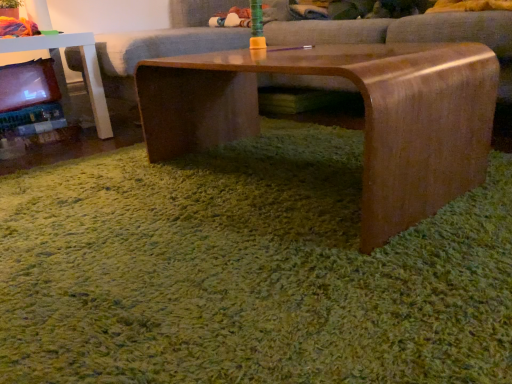
Locate an element on the screen. The image size is (512, 384). vacant area that is in front of shiny brown wood coffee table at center is located at coordinates (275, 275).